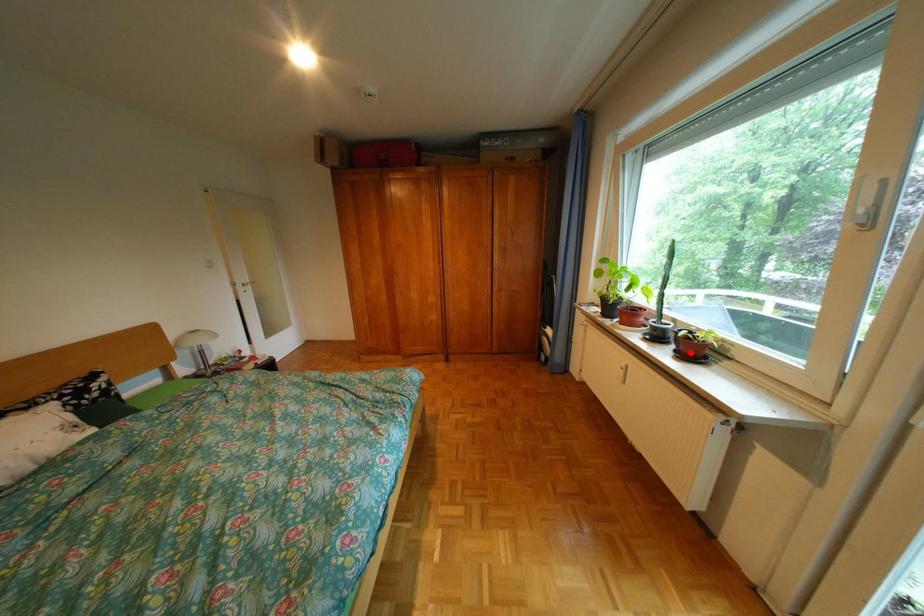
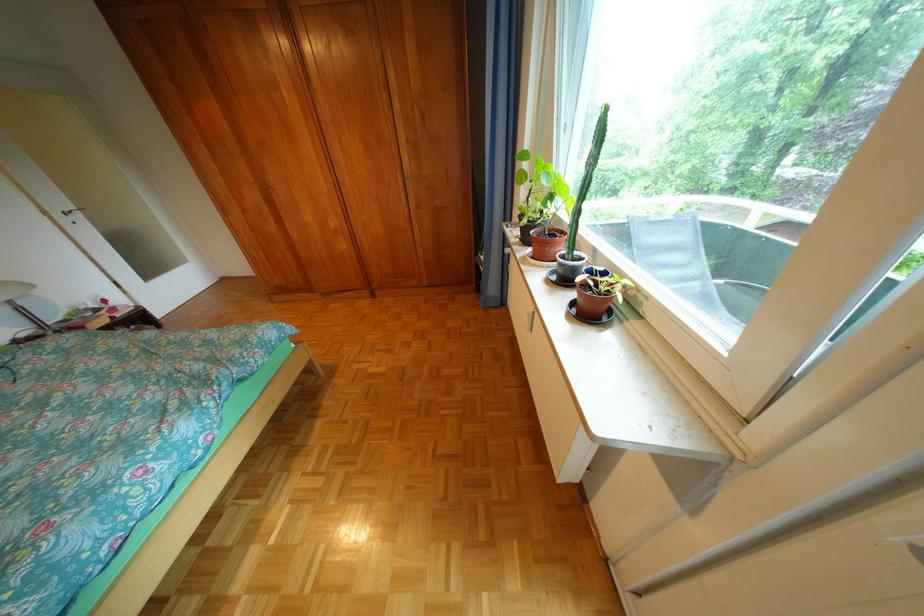
Locate, in the second image, the point that corresponds to the highlighted location in the first image.

(588, 304)